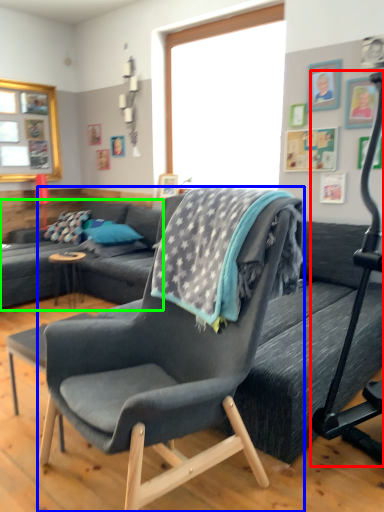
Question: Which is nearer to the baby carriage (highlighted by a red box)? chair (highlighted by a blue box) or studio couch (highlighted by a green box).

Choices:
 (A) chair
 (B) studio couch

Answer: (A)